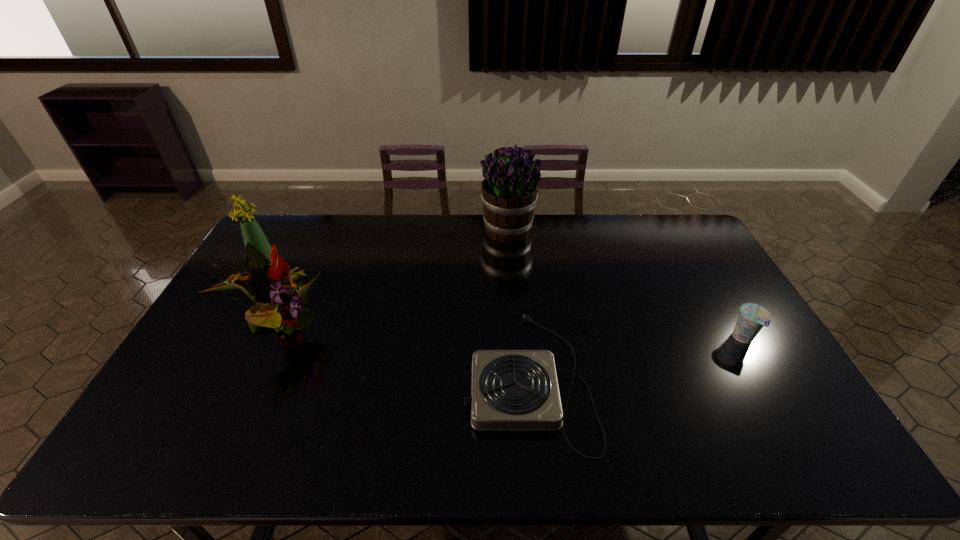
In order to click on vacant space situated 0.190m on the front-facing side of the leftmost object in this screenshot , I will do `click(333, 268)`.

This screenshot has height=540, width=960. I want to click on vacant space located 0.260m on the front-facing side of the nearest bouquet, so click(x=415, y=335).

Find the location of a particular element. The width and height of the screenshot is (960, 540). vacant space located on the left of the rightmost object is located at coordinates (712, 339).

Where is `free region located with a retractable cable on the side of the shortest object`? This screenshot has width=960, height=540. free region located with a retractable cable on the side of the shortest object is located at coordinates (416, 380).

The height and width of the screenshot is (540, 960). I want to click on vacant space located 0.200m with a retractable cable on the side of the shortest object, so click(x=389, y=380).

This screenshot has height=540, width=960. In order to click on vacant space situated with a retractable cable on the side of the shortest object in this screenshot , I will do `click(337, 380)`.

The width and height of the screenshot is (960, 540). What are the coordinates of `object at the far edge` in the screenshot? It's located at (509, 193).

Identify the location of object that is at the near edge. (511, 390).

Where is `object present at the right edge`? object present at the right edge is located at coordinates (752, 317).

You are a GUI agent. You are given a task and a screenshot of the screen. Output one action in this format:
    pyautogui.click(x=<x>, y=<y>)
    Task: Click on the vacant point at the far edge
    
    Given the screenshot: What is the action you would take?
    pyautogui.click(x=458, y=220)